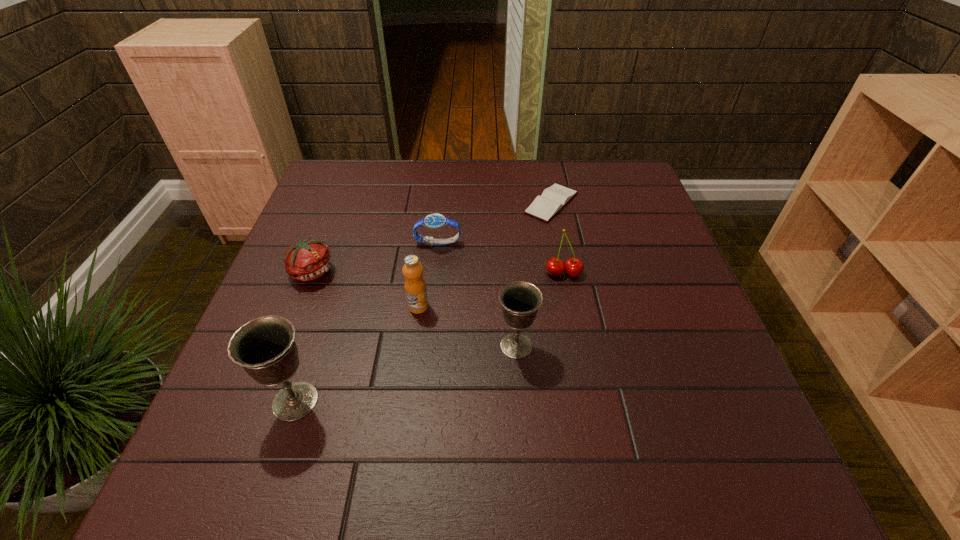
Image resolution: width=960 pixels, height=540 pixels. I want to click on orange juice, so [x=415, y=286].

This screenshot has width=960, height=540. Identify the location of blank area located 0.320m on the back of the nearer chalice. (340, 265).

Identify the location of blank area located 0.240m on the left of the farther chalice. The width and height of the screenshot is (960, 540). (381, 346).

Locate an element on the screen. Image resolution: width=960 pixels, height=540 pixels. vacant space located on the right of the farthest object is located at coordinates (598, 203).

Find the location of a particular element. Image resolution: width=960 pixels, height=540 pixels. vacant space located 0.190m on the front of the fifth tallest object is located at coordinates (279, 357).

In order to click on vacant space situated on the front of the second farthest object in this screenshot , I will do `click(428, 335)`.

Locate an element on the screen. The height and width of the screenshot is (540, 960). vacant space located with the stems of the fourth tallest object pointing upwards is located at coordinates (572, 319).

I want to click on vacant region located 0.230m on the front label of the fifth farthest object, so click(405, 410).

Image resolution: width=960 pixels, height=540 pixels. I want to click on object that is at the far edge, so click(553, 199).

Identify the location of object positioned at the near edge. (265, 347).